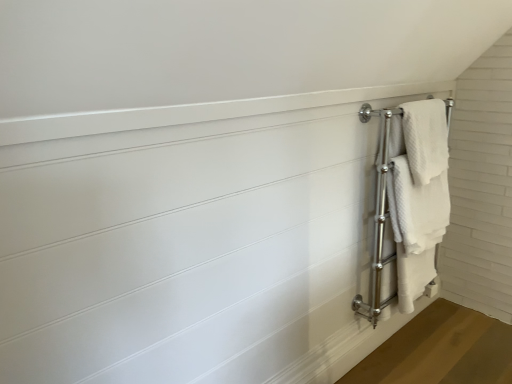
Question: Is white textured towel at right, which is counted as the first bath towel, starting from the bottom, taller or shorter than white textured towel at right?

Choices:
 (A) tall
 (B) short

Answer: (A)

Question: Would you say white textured towel at right, which is counted as the first bath towel, starting from the bottom, is to the left or to the right of white textured towel at right in the picture?

Choices:
 (A) left
 (B) right

Answer: (A)

Question: Estimate the real-world distances between objects in this image. Which object is closer to the white textured towel at right?

Choices:
 (A) white textured towel at right, the second bath towel ordered from the bottom
 (B) white textured towel at right, which is counted as the first bath towel, starting from the bottom

Answer: (B)

Question: Estimate the real-world distances between objects in this image. Which object is closer to the white textured towel at right, the 1th bath towel in the top-to-bottom sequence?

Choices:
 (A) white textured towel at right, which is counted as the first bath towel, starting from the bottom
 (B) white textured towel at right

Answer: (A)